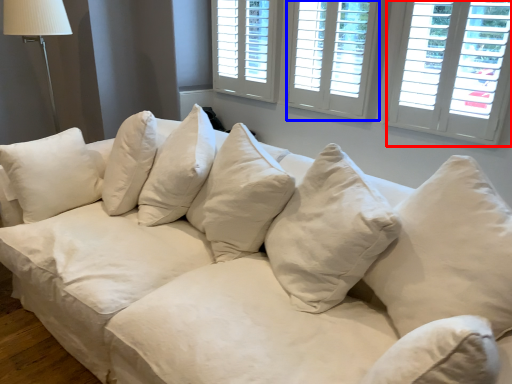
Question: Which point is closer to the camera, window (highlighted by a red box) or window (highlighted by a blue box)?

Choices:
 (A) window
 (B) window

Answer: (A)